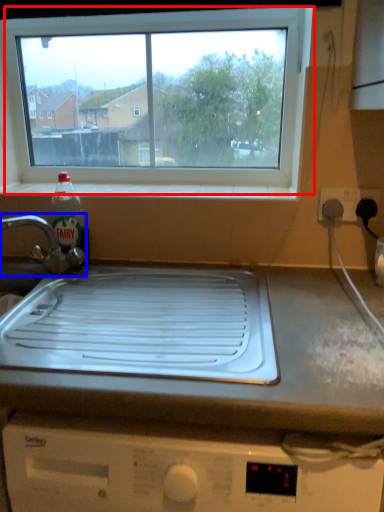
Question: Which object is closer to the camera taking this photo, window (highlighted by a red box) or tap (highlighted by a blue box)?

Choices:
 (A) window
 (B) tap

Answer: (B)